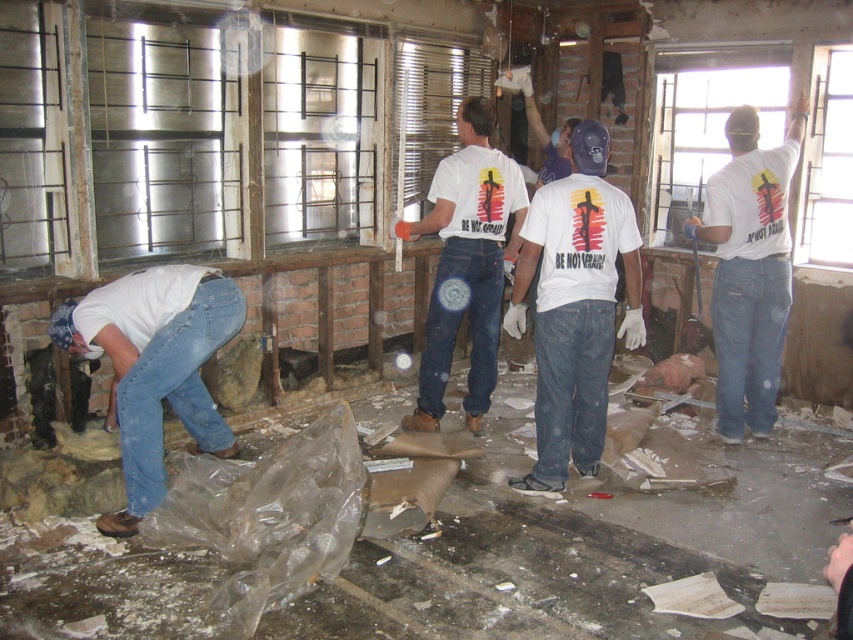
Who is positioned more to the right, white t-shirt at upper right or white t-shirt at center?

white t-shirt at upper right

Is white t-shirt at upper right thinner than white t-shirt at center?

Yes, white t-shirt at upper right is thinner than white t-shirt at center.

Does point (724, 200) lie behind point (523, 198)?

No, (724, 200) is in front of (523, 198).

At what (x,y) coordinates should I click in order to perform the action: click on white t-shirt at upper right. Please return your answer as a coordinate pair (x, y). This screenshot has height=640, width=853. Looking at the image, I should click on (749, 269).

Between white matte shirt at lower left and white t-shirt at center, which one is positioned higher?

Positioned higher is white t-shirt at center.

Which is below, white matte shirt at lower left or white t-shirt at center?

Positioned lower is white matte shirt at lower left.

Measure the distance between white matte shirt at lower left and camera.

white matte shirt at lower left and camera are 3.34 meters apart from each other.

The image size is (853, 640). In order to click on white matte shirt at lower left in this screenshot , I will do `click(155, 365)`.

Does white matte shirt at lower left appear over white t-shirt at upper right?

No, white matte shirt at lower left is not above white t-shirt at upper right.

Is white matte shirt at lower left below white t-shirt at upper right?

Indeed, white matte shirt at lower left is positioned under white t-shirt at upper right.

I want to click on white matte shirt at lower left, so 155,365.

Identify the location of white matte shirt at lower left. (155, 365).